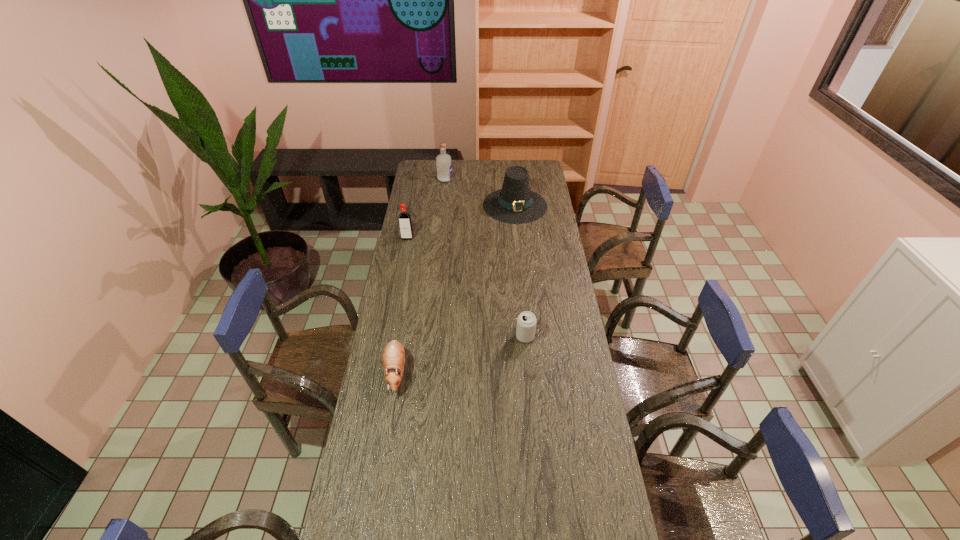
Locate an element on the screen. This screenshot has width=960, height=540. vacant area between the nearest object and the third object from left to right is located at coordinates (420, 275).

Image resolution: width=960 pixels, height=540 pixels. I want to click on vacant space that is in between the hat and the second nearest object, so click(x=520, y=271).

Where is `free space between the fourth farthest object and the left vodka`? Image resolution: width=960 pixels, height=540 pixels. free space between the fourth farthest object and the left vodka is located at coordinates (467, 287).

Where is `blank region between the hamster and the third farthest object`? Image resolution: width=960 pixels, height=540 pixels. blank region between the hamster and the third farthest object is located at coordinates (401, 305).

Where is `free area in between the farther vodka and the nearest object`? Image resolution: width=960 pixels, height=540 pixels. free area in between the farther vodka and the nearest object is located at coordinates (420, 275).

The height and width of the screenshot is (540, 960). In order to click on blank region between the left vodka and the second nearest object in this screenshot , I will do `click(467, 287)`.

At what (x,y) coordinates should I click in order to perform the action: click on free space between the third nearest object and the nearest object. Please return your answer as a coordinate pair (x, y). This screenshot has width=960, height=540. Looking at the image, I should click on 401,305.

The width and height of the screenshot is (960, 540). I want to click on unoccupied area between the hamster and the left vodka, so click(401, 305).

Find the location of `object that ranks as the third closest to the hat`. object that ranks as the third closest to the hat is located at coordinates (526, 322).

Locate which object ranks fourth in proximity to the third object from right to left. Please provide its 2D coordinates. Your answer should be formatted as a tuple, i.e. [(x, y)], where the tuple contains the x and y coordinates of a point satisfying the conditions above.

[(393, 357)]